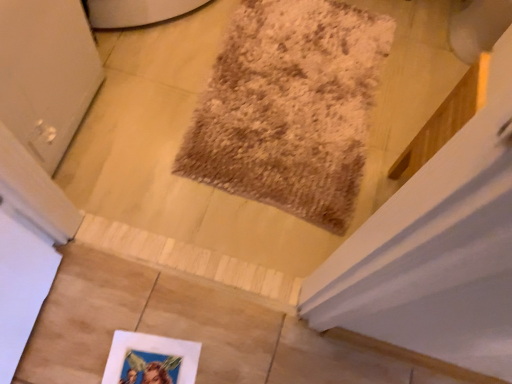
Question: Is white matte picture frame at lower center to the left or to the right of brown shaggy mat at center in the image?

Choices:
 (A) left
 (B) right

Answer: (A)

Question: Considering the positions of point (163, 337) and point (282, 72), is point (163, 337) closer or farther from the camera than point (282, 72)?

Choices:
 (A) farther
 (B) closer

Answer: (B)

Question: Is white matte picture frame at lower center in front of or behind brown shaggy mat at center in the image?

Choices:
 (A) behind
 (B) front

Answer: (B)

Question: In terms of width, does brown shaggy mat at center look wider or thinner when compared to white matte picture frame at lower center?

Choices:
 (A) wide
 (B) thin

Answer: (A)

Question: From a real-world perspective, relative to white matte picture frame at lower center, is brown shaggy mat at center vertically above or below?

Choices:
 (A) above
 (B) below

Answer: (A)

Question: Do you think brown shaggy mat at center is within white matte picture frame at lower center, or outside of it?

Choices:
 (A) outside
 (B) inside

Answer: (A)

Question: From the image's perspective, relative to white matte picture frame at lower center, is brown shaggy mat at center above or below?

Choices:
 (A) below
 (B) above

Answer: (B)